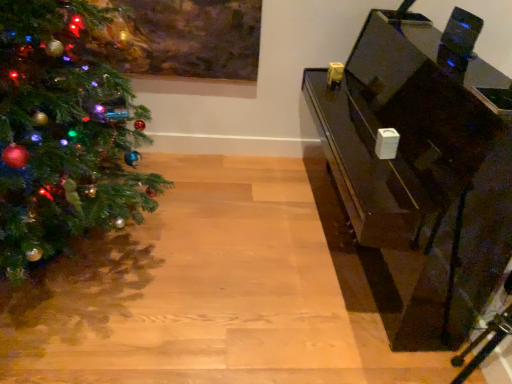
I want to click on free location to the left of glossy black piano at right, so click(234, 233).